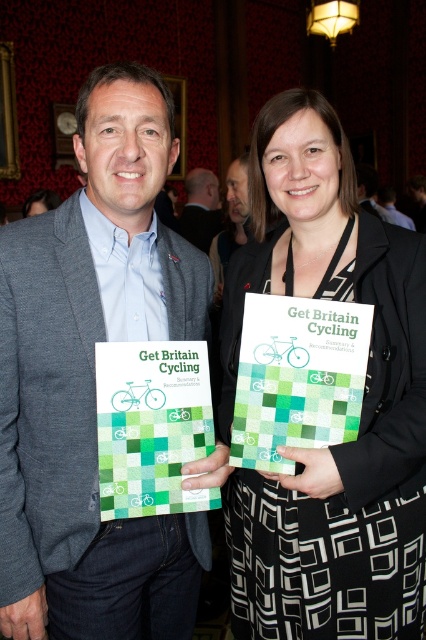
Is black textured dress at center closer to camera compared to matte gray suit at center?

Yes.

Can you confirm if black textured dress at center is shorter than matte gray suit at center?

No, black textured dress at center is not shorter than matte gray suit at center.

Does point (356, 266) come behind point (195, 193)?

No.

Locate an element on the screen. This screenshot has height=640, width=426. black textured dress at center is located at coordinates click(362, 403).

Is the position of black textured dress at center less distant than that of matte black suit at center?

Yes.

Between black textured dress at center and matte black suit at center, which one has more height?

With more height is black textured dress at center.

Between point (321, 561) and point (377, 209), which one is positioned in front?

Positioned in front is point (321, 561).

At what (x,y) coordinates should I click in order to perform the action: click on black textured dress at center. Please return your answer as a coordinate pair (x, y). The image size is (426, 640). Looking at the image, I should click on (362, 403).

Does matte gray suit at center have a smaller size compared to matte black suit at center?

Yes.

Is matte gray suit at center positioned before matte black suit at center?

No, it is not.

Does point (198, 230) lie in front of point (377, 212)?

No, it is not.

Image resolution: width=426 pixels, height=640 pixels. I want to click on matte gray suit at center, so click(201, 209).